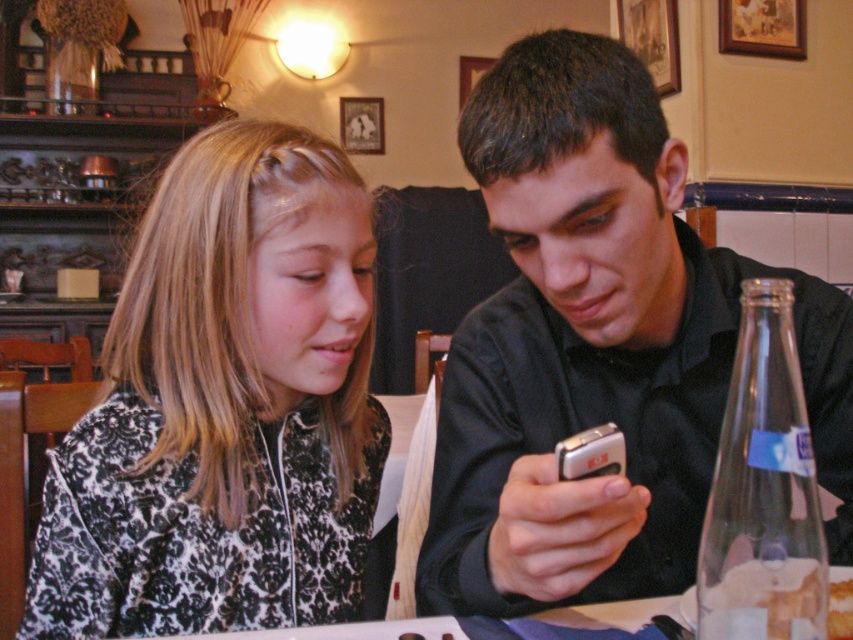
Question: Which object appears closest to the camera in this image?

Choices:
 (A) black matte shirt at center
 (B) translucent glass bread at lower right
 (C) black damask jacket at left

Answer: (B)

Question: Which of the following is the farthest from the observer?

Choices:
 (A) black matte shirt at center
 (B) translucent glass bread at lower right
 (C) black damask jacket at left

Answer: (C)

Question: Is black matte shirt at center to the left of black damask jacket at left from the viewer's perspective?

Choices:
 (A) no
 (B) yes

Answer: (A)

Question: Does black matte shirt at center appear over black damask jacket at left?

Choices:
 (A) yes
 (B) no

Answer: (A)

Question: Which object is positioned farthest from the black damask jacket at left?

Choices:
 (A) black matte shirt at center
 (B) translucent glass bread at lower right

Answer: (B)

Question: Does black matte shirt at center appear on the left side of black damask jacket at left?

Choices:
 (A) yes
 (B) no

Answer: (B)